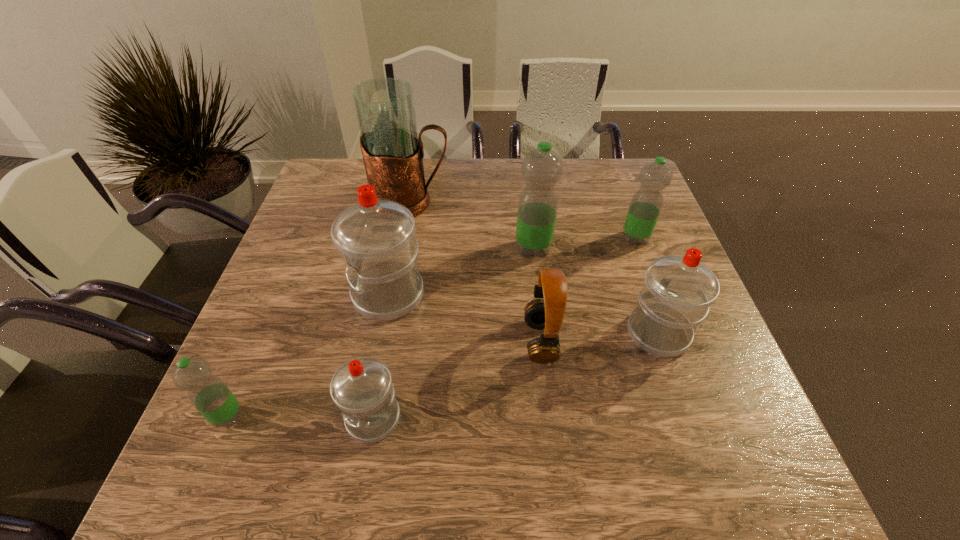
Find the location of a particular element. free area in between the rightmost white water bottle and the fourth water bottle from left to right is located at coordinates (595, 291).

Identify the location of object that is the fifth nearest to the brown headset. Image resolution: width=960 pixels, height=540 pixels. (647, 202).

Where is `the closest object to the second green water bottle from left to right`? The height and width of the screenshot is (540, 960). the closest object to the second green water bottle from left to right is located at coordinates (548, 313).

Identify which water bottle is the fourth closest to the nearest green water bottle. Please provide its 2D coordinates. Your answer should be formatted as a tuple, i.e. [(x, y)], where the tuple contains the x and y coordinates of a point satisfying the conditions above.

[(678, 290)]

Identify the location of the closest water bottle relative to the second green water bottle from left to right. (647, 202).

Where is `green water bottle that is the second closest to the brown headset`? The width and height of the screenshot is (960, 540). green water bottle that is the second closest to the brown headset is located at coordinates (647, 202).

Locate an element on the screen. This screenshot has width=960, height=540. green water bottle that stands as the closest to the fourth water bottle from left to right is located at coordinates (647, 202).

Identify which white water bottle is located as the third nearest to the biggest green water bottle. Please provide its 2D coordinates. Your answer should be formatted as a tuple, i.e. [(x, y)], where the tuple contains the x and y coordinates of a point satisfying the conditions above.

[(362, 389)]

I want to click on the second closest white water bottle to the third water bottle from right to left, so click(x=375, y=237).

Locate an element on the screen. vacant space that satisfies the following two spatial constraints: 1. on the back side of the rightmost green water bottle; 2. with the handle on the side of the pitcher is located at coordinates (622, 202).